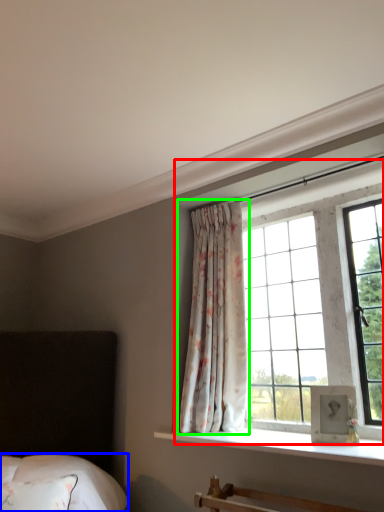
Question: Based on their relative distances, which object is farther from bay window (highlighted by a red box)? Choose from bedding (highlighted by a blue box) and curtain (highlighted by a green box).

Choices:
 (A) bedding
 (B) curtain

Answer: (A)